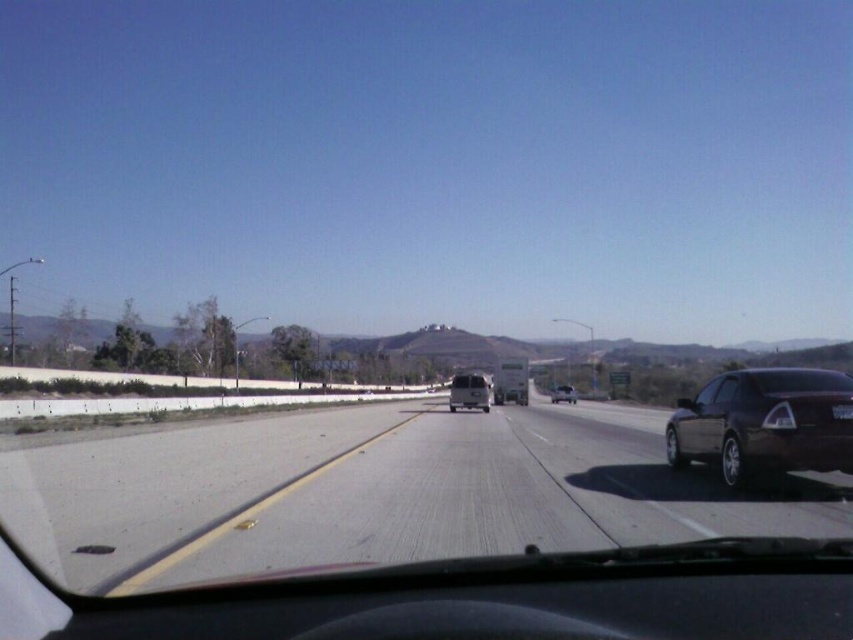
Question: Which point is closer to the camera?

Choices:
 (A) asphalt road at center
 (B) matte silver van at center

Answer: (A)

Question: Which point is closer to the camera?

Choices:
 (A) asphalt road at center
 (B) satin dark brown sedan at right
 (C) matte silver van at center
 (D) shiny silver sedan at center

Answer: (A)

Question: Observing the image, what is the correct spatial positioning of asphalt road at center in reference to shiny silver sedan at center?

Choices:
 (A) above
 (B) below

Answer: (A)

Question: Is asphalt road at center above shiny silver sedan at center?

Choices:
 (A) no
 (B) yes

Answer: (B)

Question: Which point is closer to the camera?

Choices:
 (A) satin dark brown sedan at right
 (B) shiny silver sedan at center

Answer: (A)

Question: Is satin dark brown sedan at right below matte silver van at center?

Choices:
 (A) yes
 (B) no

Answer: (B)